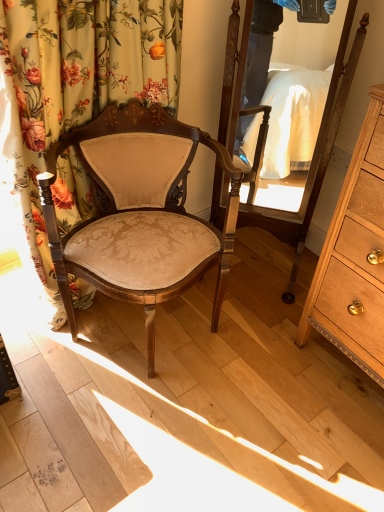
Locate an element on the screen. Image resolution: width=384 pixels, height=512 pixels. vacant area that lies between light brown wood dresser at right and matte beige fabric chair at center is located at coordinates (259, 365).